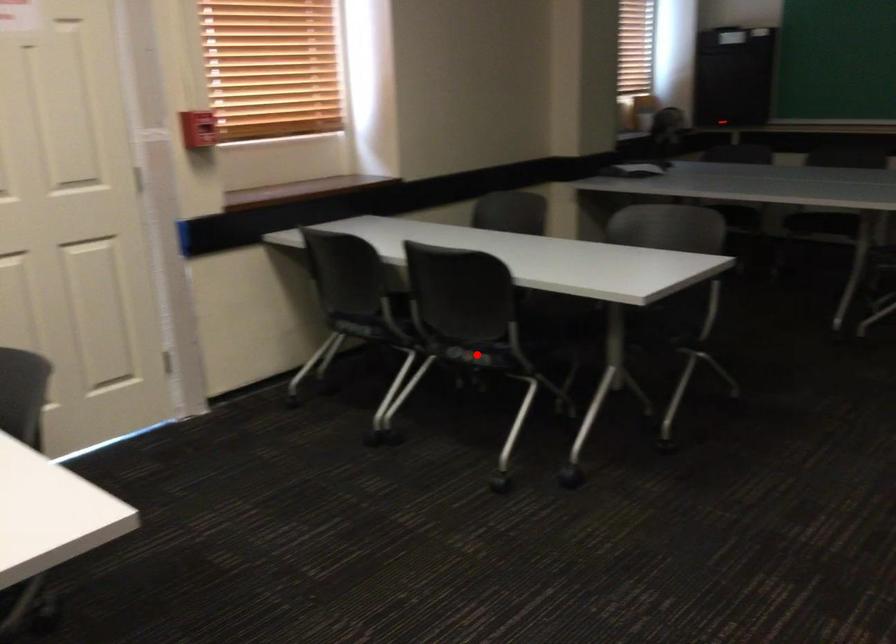
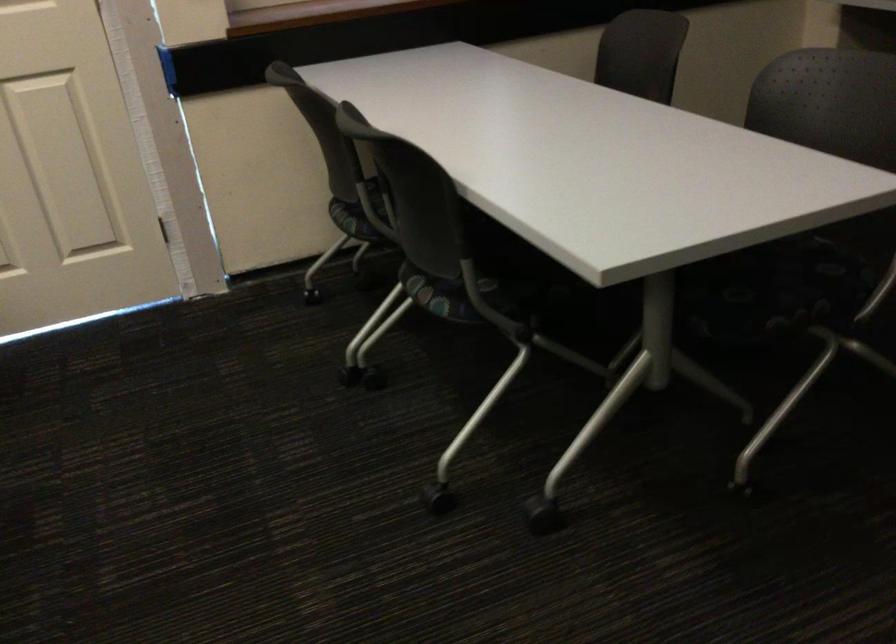
Question: I am providing you with two images of the same scene from different viewpoints. In image1, a red point is highlighted. Considering the same 3D point in image2, which of the following is correct?

Choices:
 (A) It is closer
 (B) It is farther

Answer: (A)